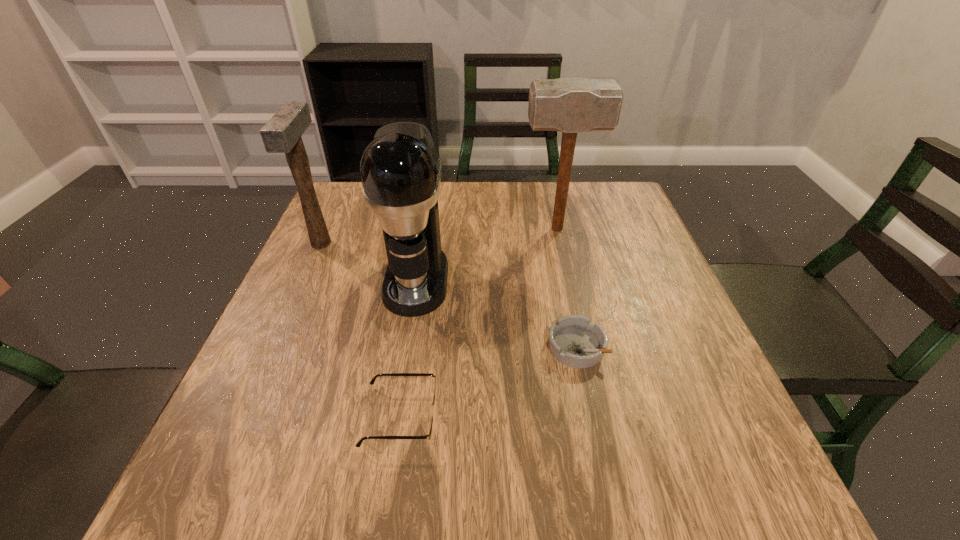
Image resolution: width=960 pixels, height=540 pixels. I want to click on vacant point at the far left corner, so click(x=371, y=225).

This screenshot has height=540, width=960. I want to click on free region at the near right corner of the desktop, so click(x=714, y=457).

Locate an element on the screen. The width and height of the screenshot is (960, 540). vacant space in between the left mallet and the spectacles is located at coordinates coord(361,330).

At what (x,y) coordinates should I click in order to perform the action: click on vacant area between the coffee maker and the leftmost object. Please return your answer as a coordinate pair (x, y). The image size is (960, 540). Looking at the image, I should click on (369, 262).

Locate an element on the screen. The width and height of the screenshot is (960, 540). free space between the ashtray and the right mallet is located at coordinates (566, 288).

This screenshot has height=540, width=960. In order to click on vacant space that's between the nearest object and the leftmost object in this screenshot , I will do `click(361, 330)`.

At what (x,y) coordinates should I click in order to perform the action: click on free space that is in between the nearest object and the coffee maker. Please return your answer as a coordinate pair (x, y). Looking at the image, I should click on (409, 348).

Where is `vacant space that is in between the right mallet and the coffee maker`? Image resolution: width=960 pixels, height=540 pixels. vacant space that is in between the right mallet and the coffee maker is located at coordinates (487, 254).

This screenshot has width=960, height=540. In order to click on vacant area between the right mallet and the fourth farthest object in this screenshot , I will do `click(566, 288)`.

The height and width of the screenshot is (540, 960). In order to click on vacant area that lies between the ashtray and the right mallet in this screenshot , I will do `click(566, 288)`.